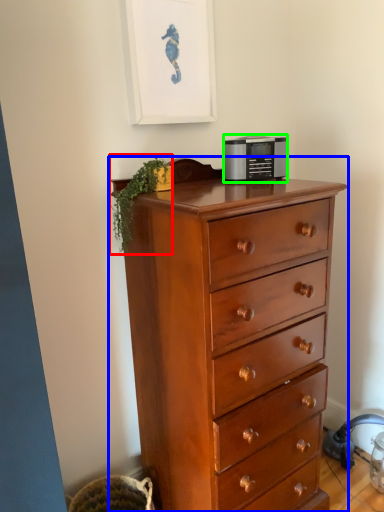
Question: Estimate the real-world distances between objects in this image. Which object is closer to plant (highlighted by a red box), chest of drawers (highlighted by a blue box) or appliance (highlighted by a green box)?

Choices:
 (A) chest of drawers
 (B) appliance

Answer: (B)